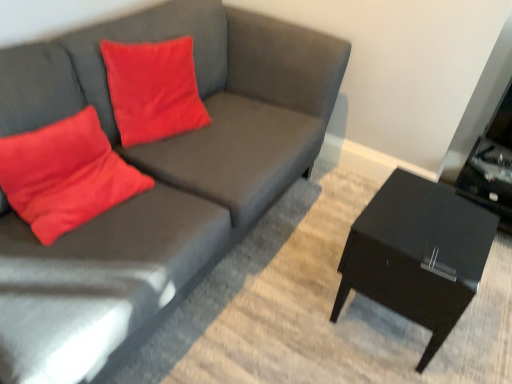
Question: Can you confirm if matte gray couch at center is shorter than black glossy side table at right?

Choices:
 (A) yes
 (B) no

Answer: (B)

Question: From a real-world perspective, does matte gray couch at center stand above black glossy side table at right?

Choices:
 (A) yes
 (B) no

Answer: (A)

Question: Can you confirm if matte gray couch at center is positioned to the right of black glossy side table at right?

Choices:
 (A) no
 (B) yes

Answer: (A)

Question: Is the position of matte gray couch at center more distant than that of black glossy side table at right?

Choices:
 (A) yes
 (B) no

Answer: (B)

Question: Is matte gray couch at center wider than black glossy side table at right?

Choices:
 (A) yes
 (B) no

Answer: (A)

Question: From the image's perspective, is matte gray couch at center above or below black glossy side table at right?

Choices:
 (A) below
 (B) above

Answer: (B)

Question: In the image, is matte gray couch at center on the left side or the right side of black glossy side table at right?

Choices:
 (A) left
 (B) right

Answer: (A)

Question: In terms of height, does matte gray couch at center look taller or shorter compared to black glossy side table at right?

Choices:
 (A) tall
 (B) short

Answer: (A)

Question: From a real-world perspective, is matte gray couch at center positioned above or below black glossy side table at right?

Choices:
 (A) below
 (B) above

Answer: (B)

Question: From their relative heights in the image, would you say matte red pillow at left is taller or shorter than black glossy side table at right?

Choices:
 (A) short
 (B) tall

Answer: (B)

Question: Is point (53, 150) positioned closer to the camera than point (394, 172)?

Choices:
 (A) closer
 (B) farther

Answer: (A)

Question: Is matte red pillow at left wider or thinner than black glossy side table at right?

Choices:
 (A) wide
 (B) thin

Answer: (B)

Question: Considering the positions of matte red pillow at left and black glossy side table at right in the image, is matte red pillow at left bigger or smaller than black glossy side table at right?

Choices:
 (A) small
 (B) big

Answer: (A)

Question: Is matte gray couch at center spatially inside matte red pillow at left, or outside of it?

Choices:
 (A) outside
 (B) inside

Answer: (A)

Question: Considering the positions of point (142, 152) and point (56, 168), is point (142, 152) closer or farther from the camera than point (56, 168)?

Choices:
 (A) farther
 (B) closer

Answer: (A)